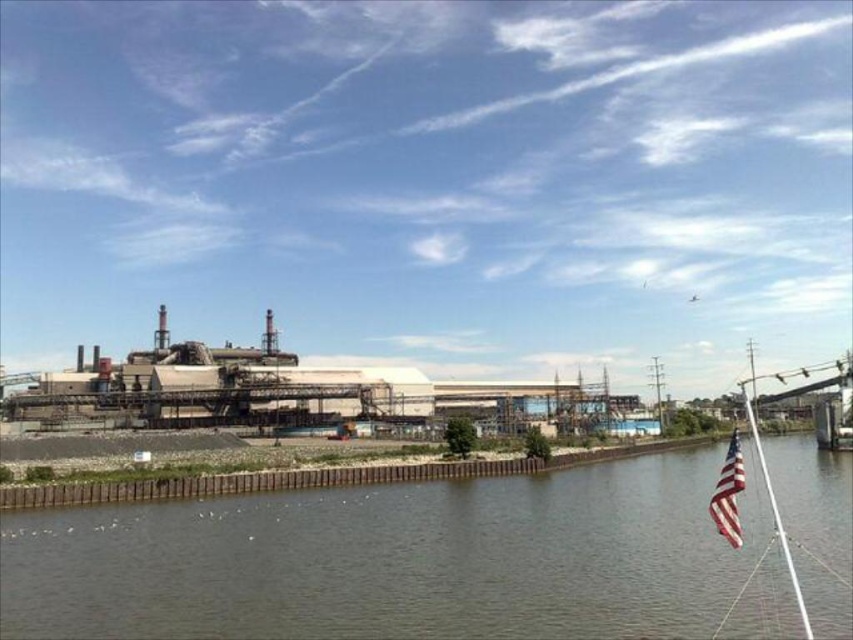
Question: In this image, where is brown concrete river at lower center located relative to american flag at right?

Choices:
 (A) below
 (B) above

Answer: (B)

Question: Is brown concrete river at lower center behind american flag at right?

Choices:
 (A) yes
 (B) no

Answer: (A)

Question: Which is farther from the white plastic mast at right?

Choices:
 (A) brown concrete river at lower center
 (B) american flag at right
 (C) industrial gray concrete factory at center

Answer: (A)

Question: Does brown concrete river at lower center appear on the right side of american flag at right?

Choices:
 (A) no
 (B) yes

Answer: (A)

Question: Considering the real-world distances, which object is farthest from the white plastic mast at right?

Choices:
 (A) brown concrete river at lower center
 (B) industrial gray concrete factory at center

Answer: (A)

Question: Which of the following is the farthest from the observer?

Choices:
 (A) brown concrete river at lower center
 (B) white plastic mast at right
 (C) american flag at right
 (D) industrial gray concrete factory at center

Answer: (B)